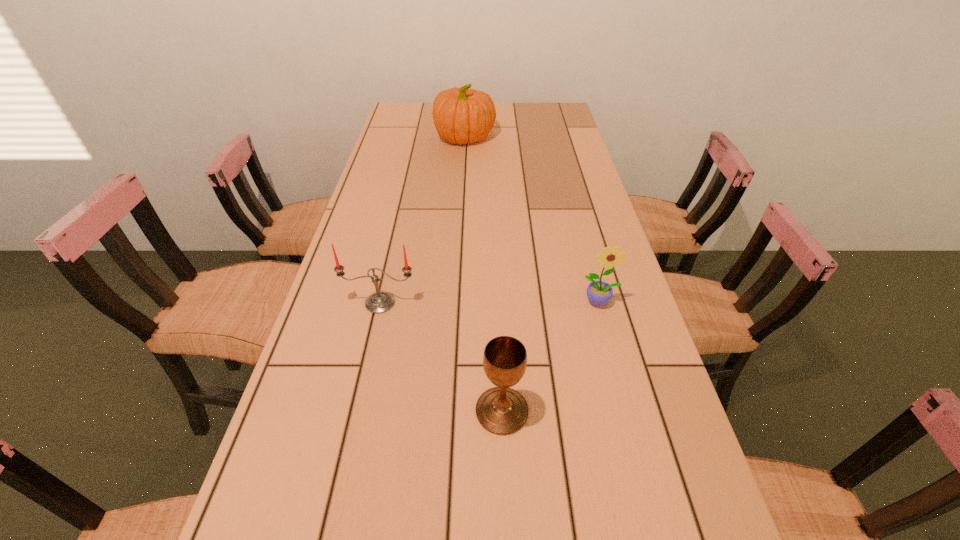
Identify the location of the farthest object. [461, 115].

I want to click on candle, so click(x=379, y=302).

Find the location of a particular element. This screenshot has width=960, height=540. the nearest object is located at coordinates (501, 410).

Locate an element on the screen. This screenshot has height=540, width=960. sunflower is located at coordinates (599, 293).

Identify the location of vacant space situated 0.300m on the surface of the farthest object. (574, 137).

At what (x,y) coordinates should I click in order to perform the action: click on free region located 0.230m on the front-facing side of the candle. Please return your answer as a coordinate pair (x, y). Looking at the image, I should click on (x=357, y=402).

You are a GUI agent. You are given a task and a screenshot of the screen. Output one action in this format:
    pyautogui.click(x=<x>, y=<y>)
    Task: Click on the free space located on the right of the nearest object
    The height and width of the screenshot is (540, 960).
    Given the screenshot: What is the action you would take?
    pyautogui.click(x=602, y=411)

Locate an element on the screen. The image size is (960, 540). free spot located on the front-facing side of the sunflower is located at coordinates (629, 407).

At what (x,y) coordinates should I click in order to perform the action: click on object situated at the far edge. Please return your answer as a coordinate pair (x, y). Looking at the image, I should click on (461, 115).

Image resolution: width=960 pixels, height=540 pixels. What are the coordinates of `object that is at the left edge` in the screenshot? It's located at (379, 302).